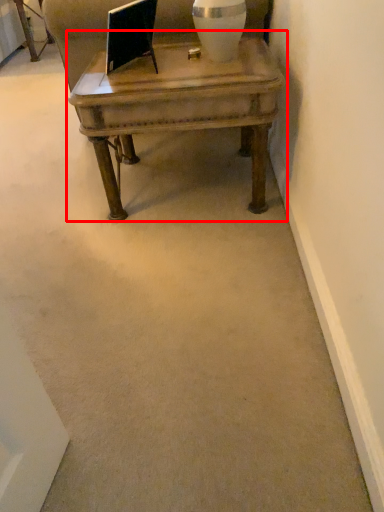
Question: From the image, what is the correct spatial relationship of coffee table (annotated by the red box) in relation to vase?

Choices:
 (A) left
 (B) right

Answer: (A)